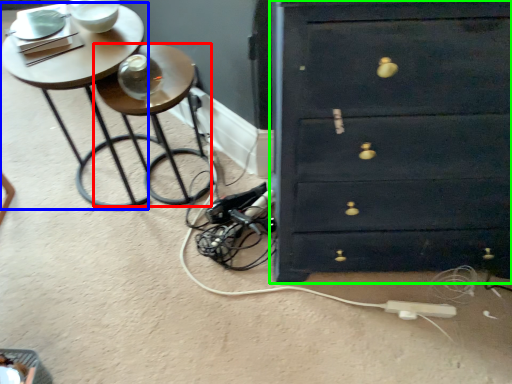
Question: Which is nearer to the side table (highlighted by a red box)? table (highlighted by a blue box) or chest of drawers (highlighted by a green box).

Choices:
 (A) table
 (B) chest of drawers

Answer: (A)